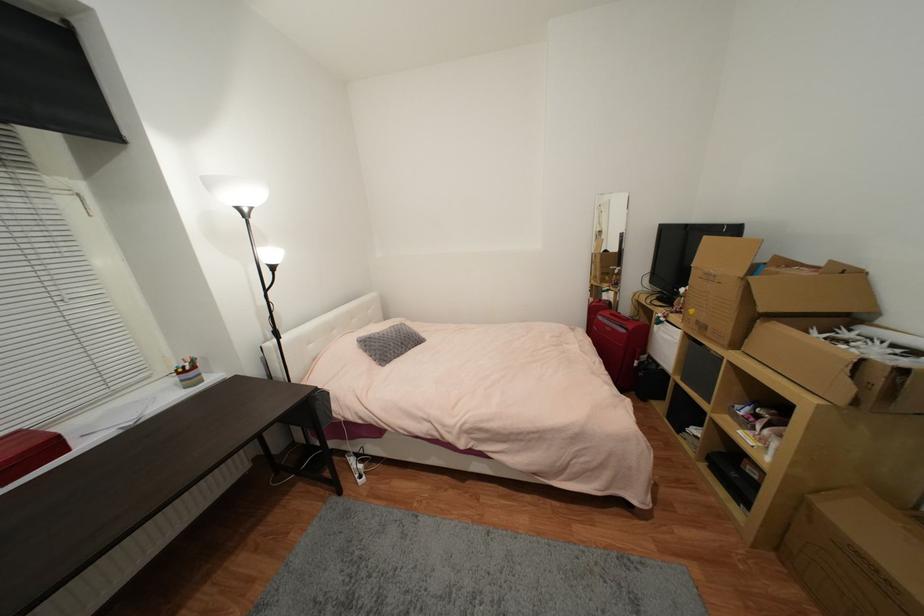
This screenshot has width=924, height=616. Describe the element at coordinates (764, 290) in the screenshot. I see `the red storage box` at that location.